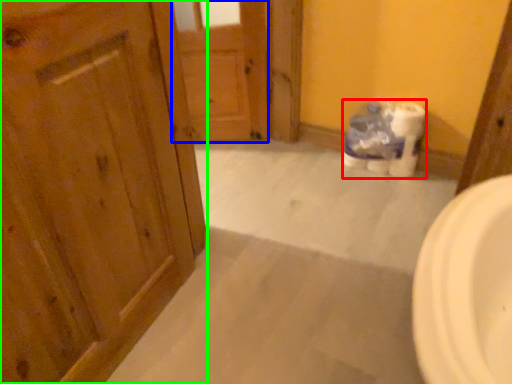
Question: Which object is the closest to the toilet paper (highlighted by a red box)? Choose among these: door (highlighted by a blue box) or door (highlighted by a green box).

Choices:
 (A) door
 (B) door

Answer: (A)